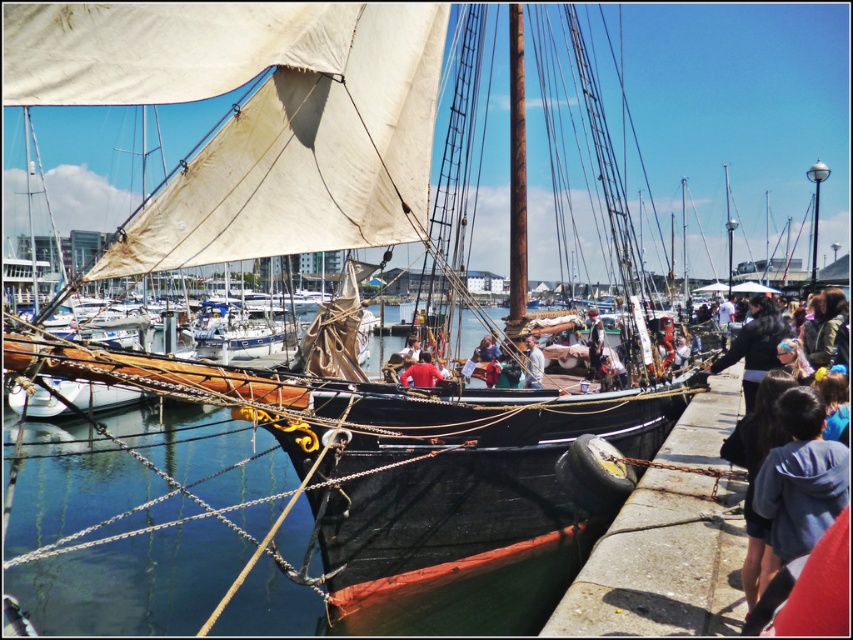
Does blue fleece jacket at lower right have a greater width compared to matte brown jacket at center?

Yes.

Which is more to the left, blue fleece jacket at lower right or matte brown jacket at center?

Positioned to the left is matte brown jacket at center.

Identify the location of blue fleece jacket at lower right. (799, 476).

Where is `blue fleece jacket at lower right`? Image resolution: width=853 pixels, height=640 pixels. blue fleece jacket at lower right is located at coordinates (799, 476).

Does dark brown leather jacket at center have a lesser width compared to light brown leather jacket at center?

In fact, dark brown leather jacket at center might be wider than light brown leather jacket at center.

Is dark brown leather jacket at center behind light brown leather jacket at center?

Yes, it is.

Who is more distant from viewer, (589, 320) or (537, 365)?

Point (589, 320)

The height and width of the screenshot is (640, 853). What are the coordinates of `dark brown leather jacket at center` in the screenshot? It's located at (595, 342).

Consider the image. Between denim jacket at right and red matte shirt at center, which one is positioned lower?

denim jacket at right

Does denim jacket at right come in front of red matte shirt at center?

Yes, denim jacket at right is in front of red matte shirt at center.

Is point (743, 513) more distant than point (437, 376)?

No, it is in front of (437, 376).

The width and height of the screenshot is (853, 640). In order to click on denim jacket at right in this screenshot , I will do `click(779, 474)`.